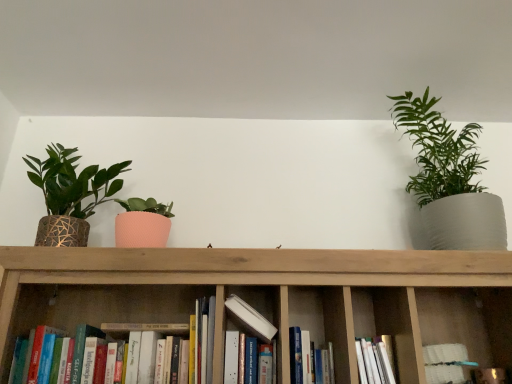
Question: Would you say wooden bookshelf at center is inside or outside white matte book at center, the 4th book in the left-to-right sequence?

Choices:
 (A) outside
 (B) inside

Answer: (A)

Question: Considering the positions of wooden bookshelf at center and white matte book at center, the first book in the right-to-left sequence, in the image, is wooden bookshelf at center wider or thinner than white matte book at center, the first book in the right-to-left sequence,?

Choices:
 (A) thin
 (B) wide

Answer: (B)

Question: Considering the real-world distances, which object is farthest from the white matte book at center, which is the 2th book in left-to-right order?

Choices:
 (A) white matte book at center, the first book in the right-to-left sequence
 (B) hardcover books at center, which is counted as the 1th book, starting from the left
 (C) hardcover book at center, which ranks as the third book in left-to-right order
 (D) green matte plant at upper right, marked as the second houseplant in a left-to-right arrangement
 (E) textured woven pot at left, acting as the first houseplant starting from the left

Answer: (D)

Question: Considering the real-world distances, which object is closest to the white matte book at center, the first book in the right-to-left sequence?

Choices:
 (A) hardcover books at center, which is counted as the 1th book, starting from the left
 (B) wooden bookshelf at center
 (C) white matte book at center, positioned as the third book in right-to-left order
 (D) textured woven pot at left, acting as the first houseplant starting from the left
 (E) wooden bookshelf at center

Answer: (B)